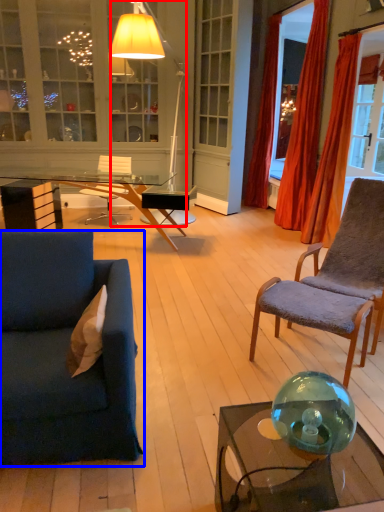
Question: Which object is closer to the camera taking this photo, lamp (highlighted by a red box) or studio couch (highlighted by a blue box)?

Choices:
 (A) lamp
 (B) studio couch

Answer: (B)